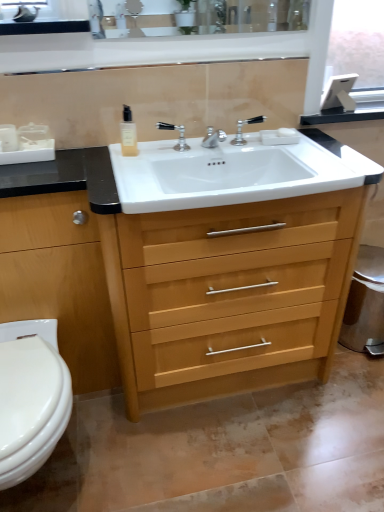
Locate an element on the screen. space that is in front of clear glass soap dispenser at upper center is located at coordinates (132, 168).